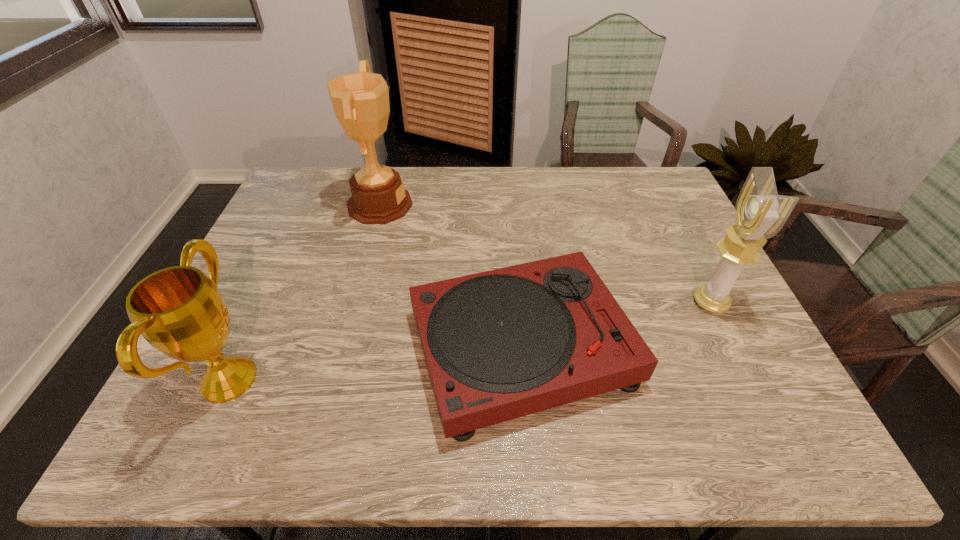
I want to click on vacant space that is in between the leftmost object and the farthest object, so click(x=304, y=292).

Locate an element on the screen. unoccupied area between the leftmost object and the second object from left to right is located at coordinates (304, 292).

Identify which object is the second nearest to the rightmost award. Please provide its 2D coordinates. Your answer should be formatted as a tuple, i.e. [(x, y)], where the tuple contains the x and y coordinates of a point satisfying the conditions above.

[(360, 100)]

Locate which object is the third closest to the rightmost award. Please provide its 2D coordinates. Your answer should be formatted as a tuple, i.e. [(x, y)], where the tuple contains the x and y coordinates of a point satisfying the conditions above.

[(179, 311)]

What are the coordinates of `the closest award to the leftmost award` in the screenshot? It's located at (360, 100).

Locate an element on the screen. the second closest award relative to the second award from left to right is located at coordinates (760, 213).

Identify the location of free location that satisfies the following two spatial constraints: 1. on the front-facing side of the farthest award; 2. on the back side of the second object from right to left. The height and width of the screenshot is (540, 960). (342, 347).

I want to click on vacant position in the image that satisfies the following two spatial constraints: 1. on the front side of the shortest object; 2. on the front-facing side of the nearest award, so click(x=524, y=380).